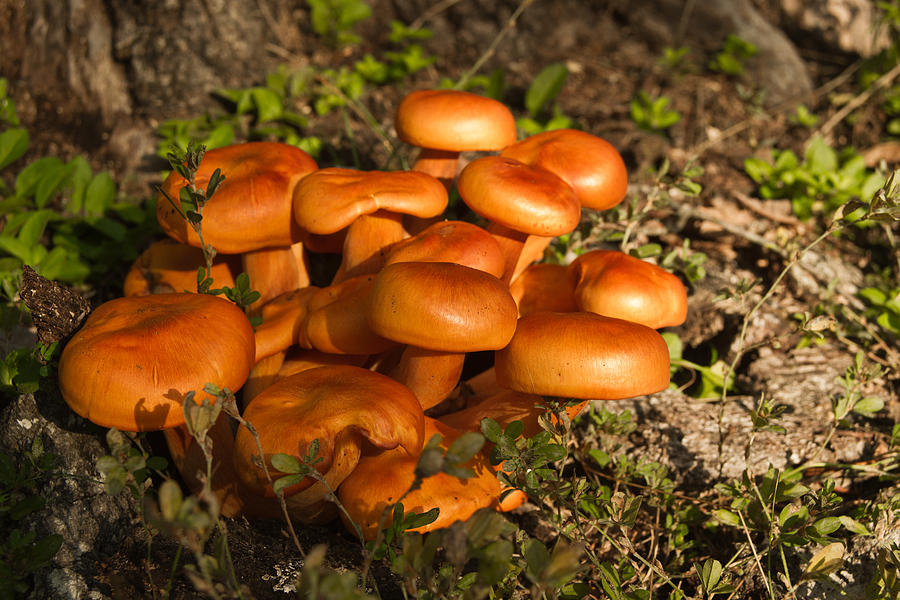
Find the location of `shade`. shade is located at coordinates (82, 535).